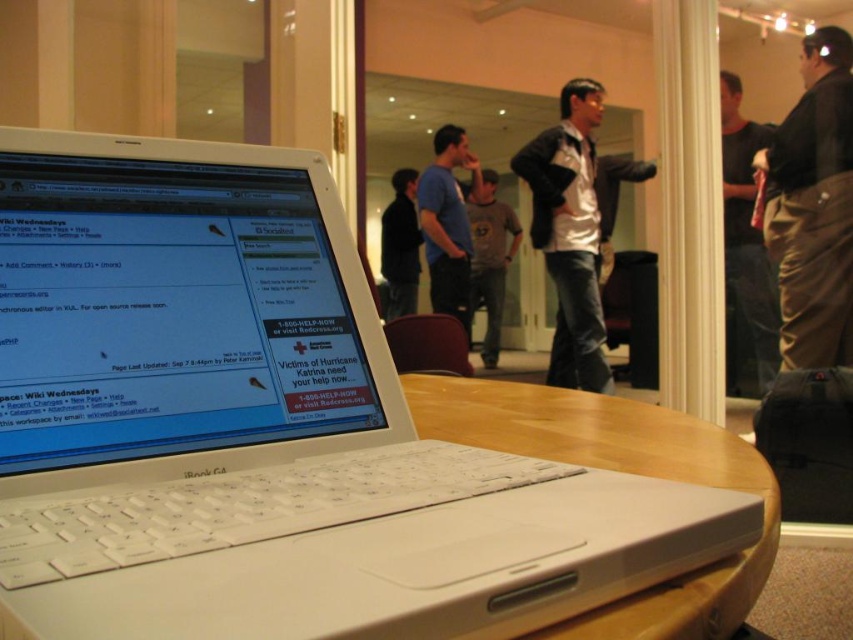
Question: In this image, where is white plastic laptop at center located relative to gray cotton t-shirt at center?

Choices:
 (A) above
 (B) below

Answer: (B)

Question: Does brown leather pants at right have a smaller size compared to black matte shirt at center?

Choices:
 (A) no
 (B) yes

Answer: (A)

Question: Among these objects, which one is farthest from the camera?

Choices:
 (A) matte blue shirt at center
 (B) gray cotton t-shirt at center

Answer: (B)

Question: Which point is farther from the camera taking this photo?

Choices:
 (A) (476, 205)
 (B) (816, 211)

Answer: (A)

Question: Estimate the real-world distances between objects in this image. Which object is farther from the white plastic laptop at center?

Choices:
 (A) white cotton shirt at center
 (B) black matte shirt at center
 (C) gray cotton t-shirt at center
 (D) matte blue shirt at center

Answer: (C)

Question: Is white cotton shirt at center to the left of gray cotton t-shirt at center from the viewer's perspective?

Choices:
 (A) yes
 (B) no

Answer: (B)